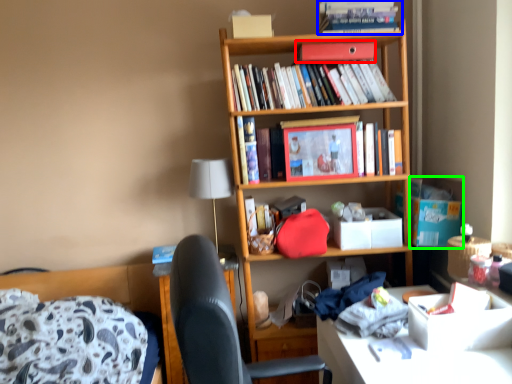
Question: Based on their relative distances, which object is nearer to paperback book (highlighted by a red box)? Choose from book (highlighted by a blue box) and cardboard box (highlighted by a green box).

Choices:
 (A) book
 (B) cardboard box

Answer: (A)